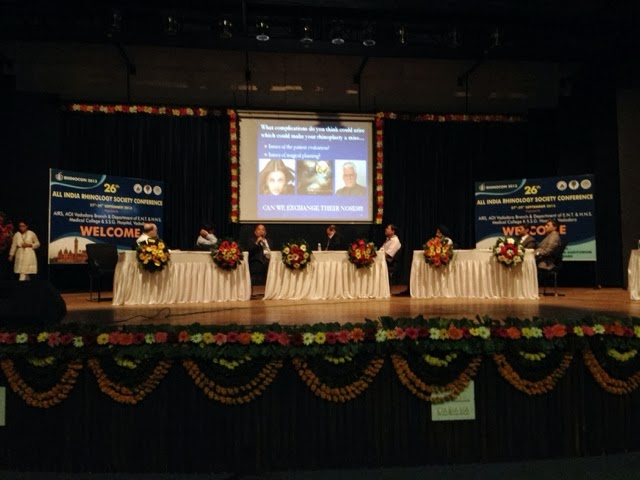
At what (x,y) coordinates should I click in order to perform the action: click on black curtain. Please return your answer as a coordinate pair (x, y). The height and width of the screenshot is (480, 640). Looking at the image, I should click on (200, 162), (365, 443).